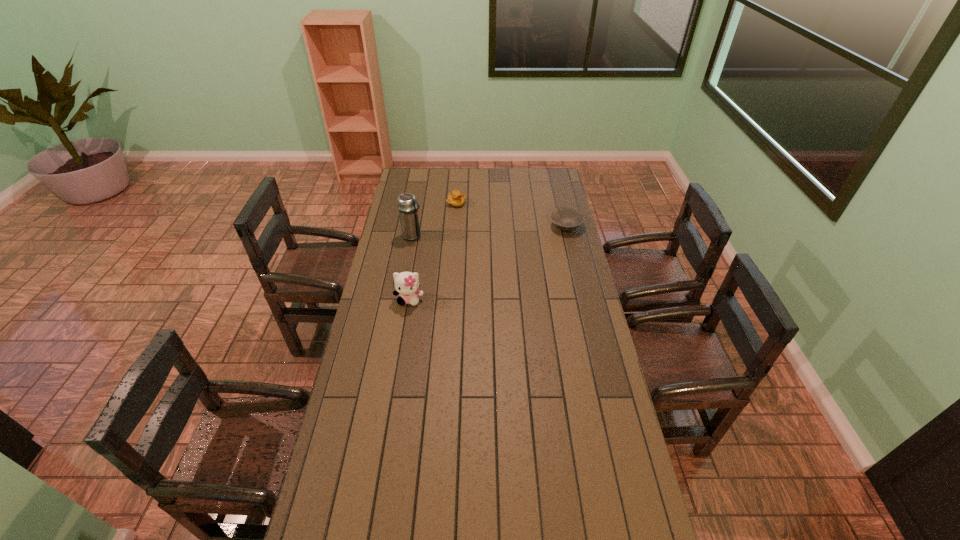
Identify the location of free space at the right edge. (588, 473).

Image resolution: width=960 pixels, height=540 pixels. I want to click on blank space at the far left corner of the desktop, so click(405, 168).

You are a GUI agent. You are given a task and a screenshot of the screen. Output one action in this format:
    pyautogui.click(x=<x>, y=<y>)
    Task: Click on the free spot at the far right corner of the desktop
    This screenshot has height=540, width=960.
    Given the screenshot: What is the action you would take?
    pyautogui.click(x=533, y=186)

Locate an element on the screen. The height and width of the screenshot is (540, 960). unoccupied area between the third tallest object and the second tallest object is located at coordinates (433, 251).

This screenshot has height=540, width=960. In order to click on empty location between the tallest object and the kitten in this screenshot , I will do `click(411, 268)`.

Identify the location of free space between the thermos bottle and the shortest object. This screenshot has height=540, width=960. (490, 231).

This screenshot has width=960, height=540. Find the location of `free area in between the bowl and the nearest object`. free area in between the bowl and the nearest object is located at coordinates (488, 263).

Identify the location of unoccupied area between the thermos bottle and the third shortest object. point(411,268).

You are a GUI agent. You are given a task and a screenshot of the screen. Output one action in this format:
    pyautogui.click(x=<x>, y=<y>)
    Task: Click on the empty space that is in between the shortest object and the duckling
    The image size is (960, 540).
    Given the screenshot: What is the action you would take?
    pyautogui.click(x=511, y=215)

Locate an element on the screen. vacant space that's between the nearest object and the thermos bottle is located at coordinates (411, 268).